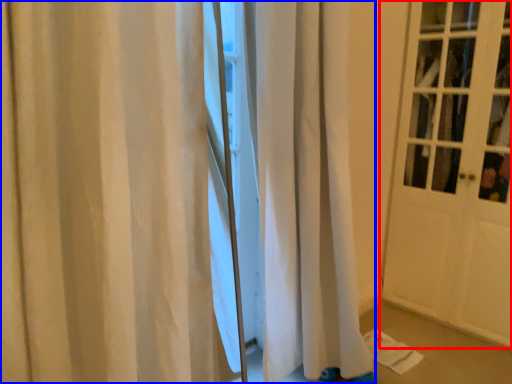
Question: Which point is closer to the camera, door (highlighted by a red box) or curtain (highlighted by a blue box)?

Choices:
 (A) door
 (B) curtain

Answer: (B)